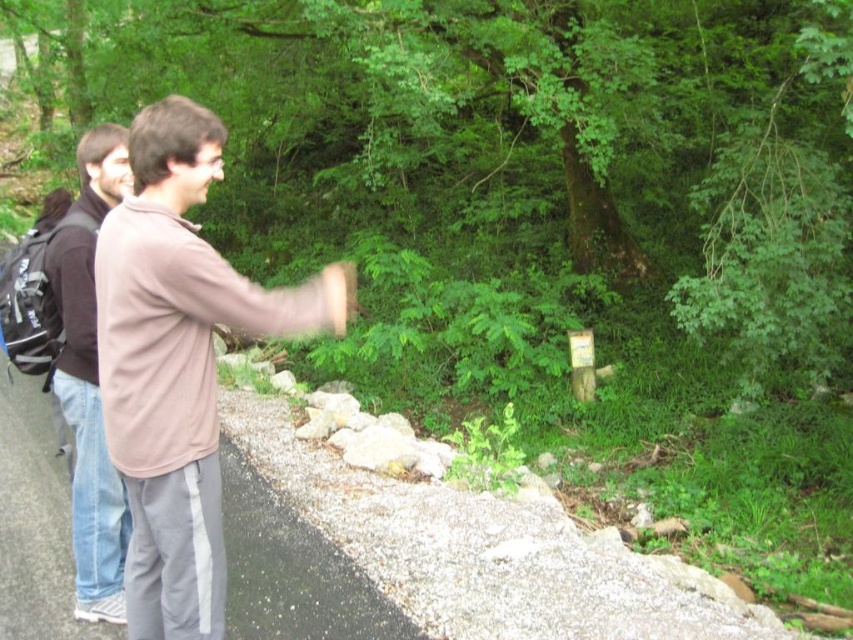
You are a photographer standing on the paved path in the forest. You want to take a photo of the light brown cotton shirt at center and the brown cotton hoodie at left. If your camera has a maximum focus range of 30 inches, will both subjects be in focus?

The light brown cotton shirt at center is 38.00 inches from the brown cotton hoodie at left. Since the distance between them exceeds the camera maximum focus range of 30 inches, the camera cannot focus on both subjects simultaneously. You may need to adjust your position or use a different camera setting.